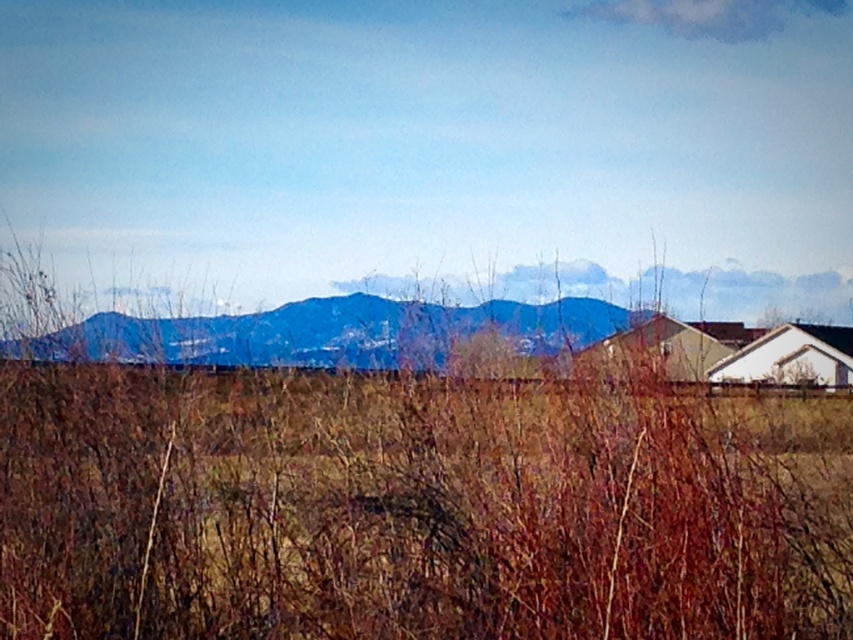
Can you confirm if brown dry grass at lower center is positioned to the right of blue matte mountain range at center?

Indeed, brown dry grass at lower center is positioned on the right side of blue matte mountain range at center.

Does brown dry grass at lower center have a larger size compared to blue matte mountain range at center?

Yes.

I want to click on brown dry grass at lower center, so click(415, 508).